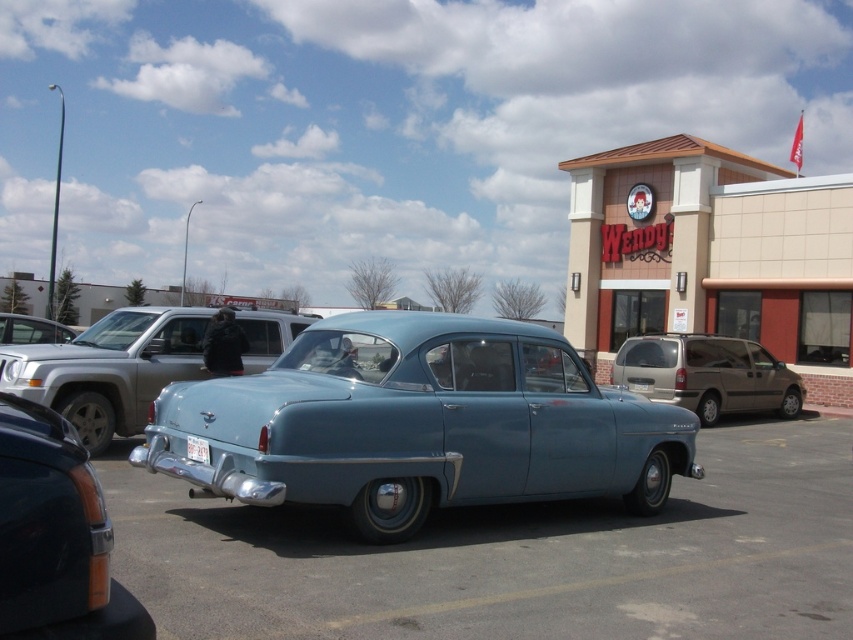
Question: Can you confirm if gold metallic minivan at right is positioned to the left of white plastic license plate at center?

Choices:
 (A) yes
 (B) no

Answer: (B)

Question: Which object is farther from the camera taking this photo?

Choices:
 (A) metallic blue sedan at center
 (B) light blue metallic car at center

Answer: (B)

Question: Does metallic blue car at center appear over light blue metallic car at center?

Choices:
 (A) no
 (B) yes

Answer: (A)

Question: Which is farther from the light blue metallic car at center?

Choices:
 (A) metallic blue sedan at center
 (B) metallic blue car at center
 (C) light blue matte car at center
 (D) white plastic license plate at center

Answer: (A)

Question: Which of the following is the farthest from the observer?

Choices:
 (A) (167, 394)
 (B) (827, 620)

Answer: (A)

Question: Is beige textured wendy's building at upper right wider than white plastic license plate at center?

Choices:
 (A) yes
 (B) no

Answer: (A)